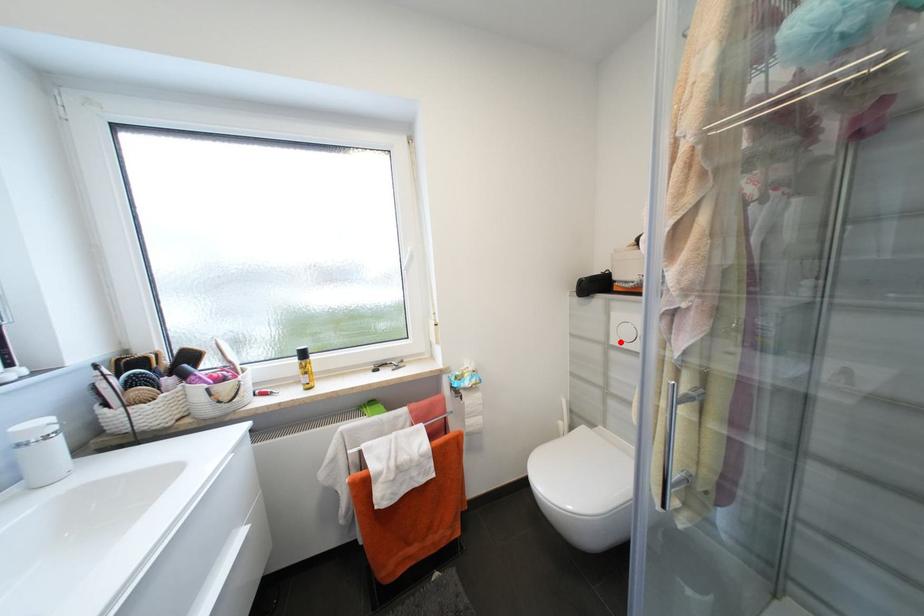
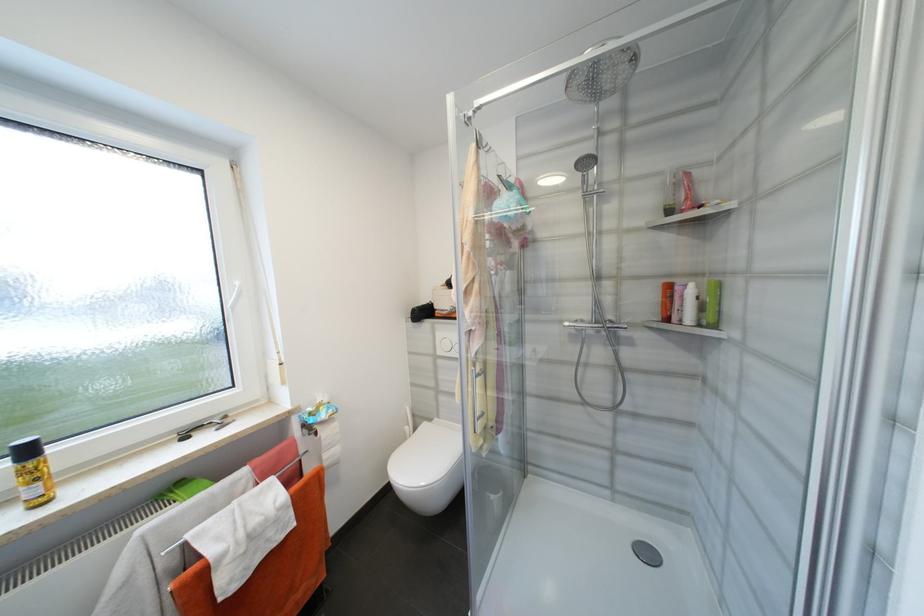
Question: A red point is marked in image1. In image2, is the corresponding 3D point closer to the camera or farther? Reply with the corresponding letter.

Choices:
 (A) The corresponding 3D point is closer.
 (B) The corresponding 3D point is farther.

Answer: (B)